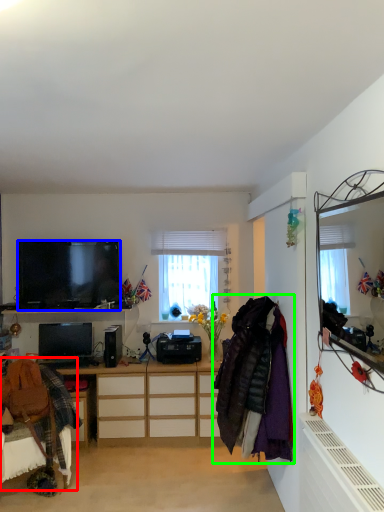
Question: Considering the real-world distances, which object is farthest from swivel chair (highlighted by a red box)? television (highlighted by a blue box) or clothing (highlighted by a green box)?

Choices:
 (A) television
 (B) clothing

Answer: (B)